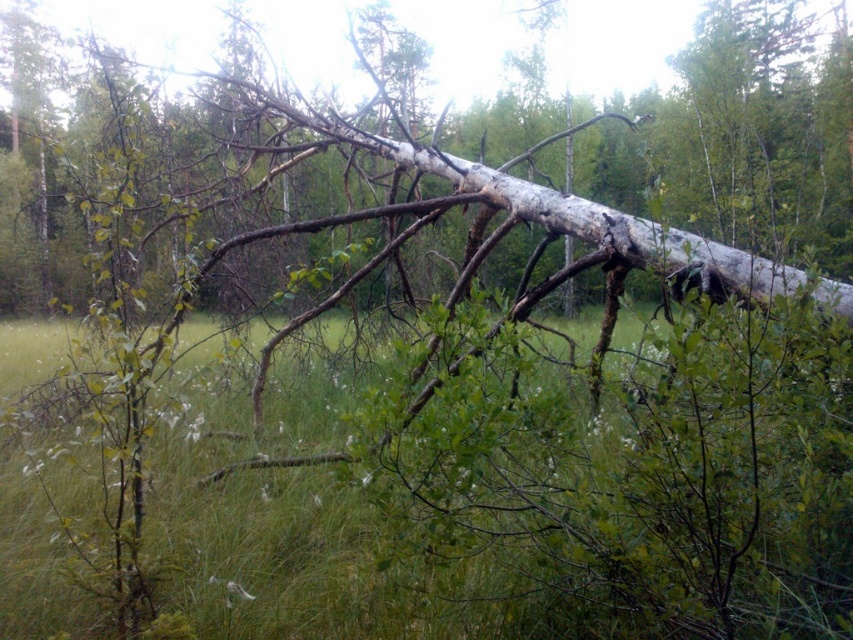
You are a hiker trying to cross a fallen tree in the forest. You see the green grass at center and the white bark tree at center. Which one is wider?

The white bark tree at center is wider than the green grass at center.

You are a hiker who wants to cross the area where the green grass at center and the white bark tree at center are located. Can you walk through the area between them without bending down?

The green grass at center is shorter than the white bark tree at center, so you can walk through the area between them without bending down since the grass is not tall enough to obstruct your path.